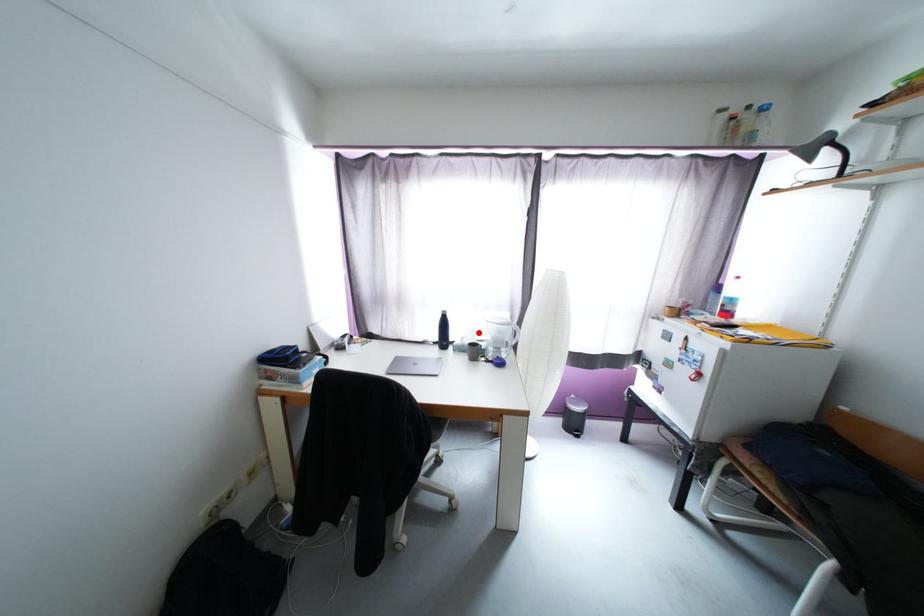
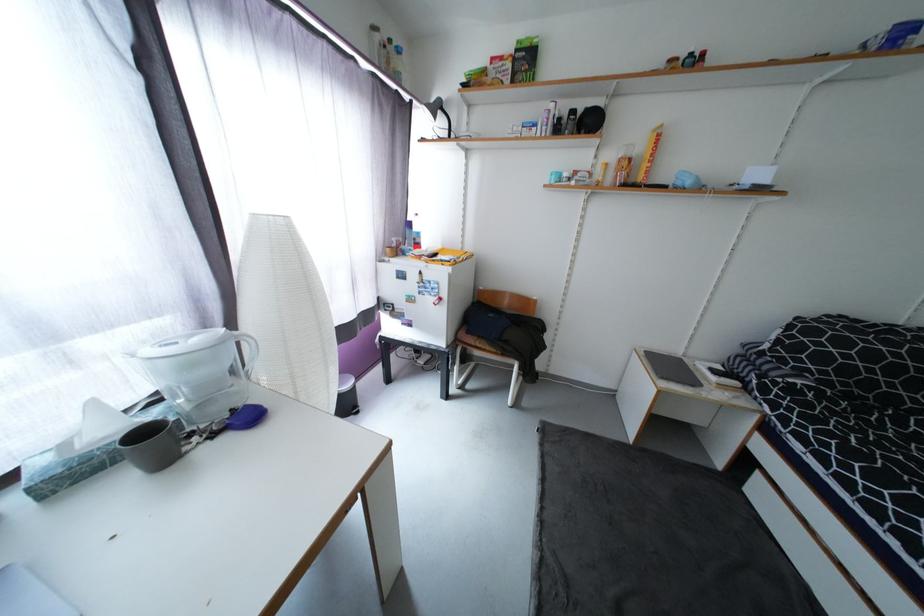
Find the pixel in the second image that matches the highlighted location in the first image.

(102, 407)